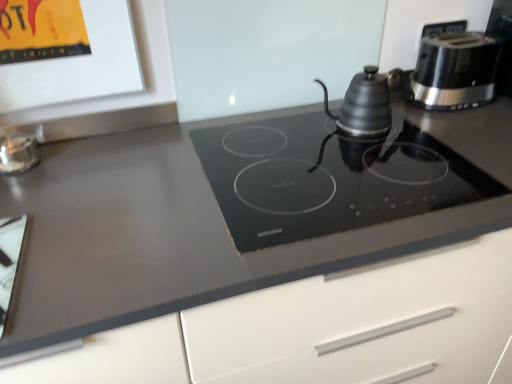
I want to click on matte black kettle at upper right, the first kitchen appliance viewed from the left, so click(x=366, y=103).

This screenshot has height=384, width=512. What are the coordinates of `black glass cooktop at center` in the screenshot? It's located at (329, 178).

Identify the location of white glossy cutting board at lower left, which is the 1th appliance in bottom-to-top order. The height and width of the screenshot is (384, 512). (9, 261).

Locate an element on the screen. This screenshot has height=384, width=512. black plastic toaster at upper right, acting as the first kitchen appliance starting from the right is located at coordinates (455, 71).

What do you see at coordinates (19, 148) in the screenshot? I see `clear glass jar at left, placed as the 1th appliance when sorted from top to bottom` at bounding box center [19, 148].

The height and width of the screenshot is (384, 512). In order to click on matte black kettle at upper right, the 2th kitchen appliance positioned from the right in this screenshot , I will do `click(366, 103)`.

Looking at this image, from a real-world perspective, which is physically below, matte black kettle at upper right, the first kitchen appliance viewed from the left, or white glossy cutting board at lower left, marked as the second appliance in a back-to-front arrangement?

white glossy cutting board at lower left, marked as the second appliance in a back-to-front arrangement.

Is matte black kettle at upper right, the first kitchen appliance viewed from the left, in front of or behind white glossy cutting board at lower left, marked as the second appliance in a back-to-front arrangement, in the image?

Clearly, matte black kettle at upper right, the first kitchen appliance viewed from the left, is behind white glossy cutting board at lower left, marked as the second appliance in a back-to-front arrangement.

Considering the sizes of matte black kettle at upper right, the 2th kitchen appliance positioned from the right, and white glossy cutting board at lower left, which ranks as the second appliance in top-to-bottom order, in the image, is matte black kettle at upper right, the 2th kitchen appliance positioned from the right, bigger or smaller than white glossy cutting board at lower left, which ranks as the second appliance in top-to-bottom order,?

In the image, matte black kettle at upper right, the 2th kitchen appliance positioned from the right, appears to be larger than white glossy cutting board at lower left, which ranks as the second appliance in top-to-bottom order.

Is matte black kettle at upper right, the 2th kitchen appliance positioned from the right, situated inside white glossy cutting board at lower left, which is counted as the 1th appliance, starting from the front, or outside?

matte black kettle at upper right, the 2th kitchen appliance positioned from the right, is outside white glossy cutting board at lower left, which is counted as the 1th appliance, starting from the front.

Based on the photo, which of these two, clear glass jar at left, which is the second appliance in front-to-back order, or black plastic toaster at upper right, arranged as the second kitchen appliance when viewed from the left, is smaller?

With smaller size is clear glass jar at left, which is the second appliance in front-to-back order.

Is clear glass jar at left, the 1th appliance positioned from the back, inside or outside of black plastic toaster at upper right, arranged as the second kitchen appliance when viewed from the left?

clear glass jar at left, the 1th appliance positioned from the back, is outside black plastic toaster at upper right, arranged as the second kitchen appliance when viewed from the left.

Visually, is clear glass jar at left, which is the second appliance in front-to-back order, positioned to the left or to the right of black plastic toaster at upper right, acting as the first kitchen appliance starting from the right?

clear glass jar at left, which is the second appliance in front-to-back order, is to the left of black plastic toaster at upper right, acting as the first kitchen appliance starting from the right.

Measure the distance from clear glass jar at left, placed as the 1th appliance when sorted from top to bottom, to black plastic toaster at upper right, acting as the first kitchen appliance starting from the right.

A distance of 1.08 meters exists between clear glass jar at left, placed as the 1th appliance when sorted from top to bottom, and black plastic toaster at upper right, acting as the first kitchen appliance starting from the right.

What's the angular difference between clear glass jar at left, placed as the 1th appliance when sorted from top to bottom, and white glossy cutting board at lower left, which ranks as the second appliance in top-to-bottom order,'s facing directions?

They differ by 0.000994 degrees in their facing directions.

From a real-world perspective, is clear glass jar at left, which is the second appliance in front-to-back order, physically located above or below white glossy cutting board at lower left, which is counted as the 1th appliance, starting from the front?

clear glass jar at left, which is the second appliance in front-to-back order, is above white glossy cutting board at lower left, which is counted as the 1th appliance, starting from the front.

Relative to white glossy cutting board at lower left, which is the 1th appliance in bottom-to-top order, is clear glass jar at left, the 2th appliance from the bottom, in front or behind?

Clearly, clear glass jar at left, the 2th appliance from the bottom, is behind white glossy cutting board at lower left, which is the 1th appliance in bottom-to-top order.

Find the location of `kitchen appliance directly beneath the black plastic toaster at upper right, arranged as the second kitchen appliance when viewed from the left (from a real-world perspective)`. kitchen appliance directly beneath the black plastic toaster at upper right, arranged as the second kitchen appliance when viewed from the left (from a real-world perspective) is located at coordinates (366, 103).

Is matte black kettle at upper right, the 2th kitchen appliance positioned from the right, aimed at black plastic toaster at upper right, acting as the first kitchen appliance starting from the right?

No, matte black kettle at upper right, the 2th kitchen appliance positioned from the right, is not facing towards black plastic toaster at upper right, acting as the first kitchen appliance starting from the right.

Can you tell me how much matte black kettle at upper right, the first kitchen appliance viewed from the left, and black plastic toaster at upper right, acting as the first kitchen appliance starting from the right, differ in facing direction?

They differ by 1.64 degrees in their facing directions.

Can you confirm if matte black kettle at upper right, the 2th kitchen appliance positioned from the right, is positioned to the left of black plastic toaster at upper right, arranged as the second kitchen appliance when viewed from the left?

Indeed, matte black kettle at upper right, the 2th kitchen appliance positioned from the right, is positioned on the left side of black plastic toaster at upper right, arranged as the second kitchen appliance when viewed from the left.

Considering the relative positions of matte black kettle at upper right, the 2th kitchen appliance positioned from the right, and black glass cooktop at center in the image provided, is matte black kettle at upper right, the 2th kitchen appliance positioned from the right, behind black glass cooktop at center?

Yes, matte black kettle at upper right, the 2th kitchen appliance positioned from the right, is further from the camera.

Between matte black kettle at upper right, the first kitchen appliance viewed from the left, and black glass cooktop at center, which one appears on the right side from the viewer's perspective?

matte black kettle at upper right, the first kitchen appliance viewed from the left, is more to the right.

Which is closer, [391,123] or [360,209]?

Positioned in front is point [360,209].

Would you consider black glass cooktop at center to be distant from matte black kettle at upper right, the 2th kitchen appliance positioned from the right?

black glass cooktop at center is near matte black kettle at upper right, the 2th kitchen appliance positioned from the right, not far away.

Can you confirm if black glass cooktop at center is positioned to the right of matte black kettle at upper right, the first kitchen appliance viewed from the left?

In fact, black glass cooktop at center is to the left of matte black kettle at upper right, the first kitchen appliance viewed from the left.

Is black glass cooktop at center located outside matte black kettle at upper right, the first kitchen appliance viewed from the left?

Yes, black glass cooktop at center is located beyond the bounds of matte black kettle at upper right, the first kitchen appliance viewed from the left.

Considering the sizes of objects black glass cooktop at center and matte black kettle at upper right, the 2th kitchen appliance positioned from the right, in the image provided, who is wider, black glass cooktop at center or matte black kettle at upper right, the 2th kitchen appliance positioned from the right,?

black glass cooktop at center is wider.

Is black plastic toaster at upper right, arranged as the second kitchen appliance when viewed from the left, bigger or smaller than matte black kettle at upper right, the 2th kitchen appliance positioned from the right?

Considering their sizes, black plastic toaster at upper right, arranged as the second kitchen appliance when viewed from the left, takes up more space than matte black kettle at upper right, the 2th kitchen appliance positioned from the right.

From a real-world perspective, is black plastic toaster at upper right, acting as the first kitchen appliance starting from the right, physically below matte black kettle at upper right, the 2th kitchen appliance positioned from the right?

Incorrect, from a real-world perspective, black plastic toaster at upper right, acting as the first kitchen appliance starting from the right, is higher than matte black kettle at upper right, the 2th kitchen appliance positioned from the right.

Is black plastic toaster at upper right, acting as the first kitchen appliance starting from the right, taller than matte black kettle at upper right, the 2th kitchen appliance positioned from the right?

Yes.

The width and height of the screenshot is (512, 384). In order to click on the 2nd appliance to the left when counting from the matte black kettle at upper right, the 2th kitchen appliance positioned from the right in this screenshot , I will do `click(9, 261)`.

In order to click on the 2nd kitchen appliance counting from the right side of the clear glass jar at left, the 2th appliance from the bottom in this screenshot , I will do `click(455, 71)`.

Looking at the image, which one is located closer to black glass cooktop at center, white glossy cutting board at lower left, which is counted as the 1th appliance, starting from the front, or black plastic toaster at upper right, acting as the first kitchen appliance starting from the right?

Among the two, black plastic toaster at upper right, acting as the first kitchen appliance starting from the right, is located nearer to black glass cooktop at center.

From the image, which object appears to be farther from black plastic toaster at upper right, arranged as the second kitchen appliance when viewed from the left, clear glass jar at left, the 1th appliance positioned from the back, or black glass cooktop at center?

Based on the image, clear glass jar at left, the 1th appliance positioned from the back, appears to be further to black plastic toaster at upper right, arranged as the second kitchen appliance when viewed from the left.

Looking at the image, which one is located closer to white glossy cutting board at lower left, which ranks as the second appliance in top-to-bottom order, black glass cooktop at center or clear glass jar at left, the 2th appliance from the bottom?

Based on the image, clear glass jar at left, the 2th appliance from the bottom, appears to be nearer to white glossy cutting board at lower left, which ranks as the second appliance in top-to-bottom order.

Based on their spatial positions, is clear glass jar at left, the 2th appliance from the bottom, or black plastic toaster at upper right, arranged as the second kitchen appliance when viewed from the left, further from black glass cooktop at center?

clear glass jar at left, the 2th appliance from the bottom, is positioned further to the anchor black glass cooktop at center.

Based on their spatial positions, is black glass cooktop at center or white glossy cutting board at lower left, which ranks as the second appliance in top-to-bottom order, closer to black plastic toaster at upper right, acting as the first kitchen appliance starting from the right?

Among the two, black glass cooktop at center is located nearer to black plastic toaster at upper right, acting as the first kitchen appliance starting from the right.

Considering their positions, is matte black kettle at upper right, the first kitchen appliance viewed from the left, positioned closer to clear glass jar at left, the 2th appliance from the bottom, than white glossy cutting board at lower left, which is the 1th appliance in bottom-to-top order?

The object closer to clear glass jar at left, the 2th appliance from the bottom, is white glossy cutting board at lower left, which is the 1th appliance in bottom-to-top order.

Based on their spatial positions, is white glossy cutting board at lower left, which is counted as the 1th appliance, starting from the front, or clear glass jar at left, the 2th appliance from the bottom, further from black glass cooktop at center?

clear glass jar at left, the 2th appliance from the bottom, is positioned further to the anchor black glass cooktop at center.

From the picture: When comparing their distances from black glass cooktop at center, does matte black kettle at upper right, the first kitchen appliance viewed from the left, or white glossy cutting board at lower left, which ranks as the second appliance in top-to-bottom order, seem closer?

The object closer to black glass cooktop at center is matte black kettle at upper right, the first kitchen appliance viewed from the left.

This screenshot has height=384, width=512. In order to click on kitchen appliance between white glossy cutting board at lower left, marked as the second appliance in a back-to-front arrangement, and black plastic toaster at upper right, acting as the first kitchen appliance starting from the right, in the horizontal direction in this screenshot , I will do `click(366, 103)`.

This screenshot has width=512, height=384. What are the coordinates of `gas stove between white glossy cutting board at lower left, marked as the second appliance in a back-to-front arrangement, and black plastic toaster at upper right, acting as the first kitchen appliance starting from the right, in the horizontal direction` in the screenshot? It's located at (329, 178).

Find the location of `gas stove between clear glass jar at left, the 1th appliance positioned from the back, and matte black kettle at upper right, the 2th kitchen appliance positioned from the right, from left to right`. gas stove between clear glass jar at left, the 1th appliance positioned from the back, and matte black kettle at upper right, the 2th kitchen appliance positioned from the right, from left to right is located at coordinates (329, 178).

At what (x,y) coordinates should I click in order to perform the action: click on appliance situated between white glossy cutting board at lower left, which is the 1th appliance in bottom-to-top order, and matte black kettle at upper right, the first kitchen appliance viewed from the left, from left to right. Please return your answer as a coordinate pair (x, y). This screenshot has height=384, width=512. Looking at the image, I should click on (19, 148).